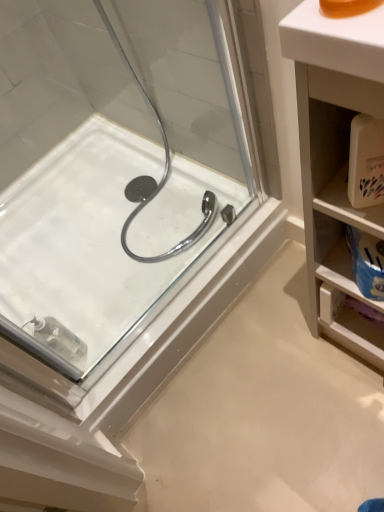
Where is `vacant space positioned to the left of white plastic cabinet at right`? The height and width of the screenshot is (512, 384). vacant space positioned to the left of white plastic cabinet at right is located at coordinates (297, 366).